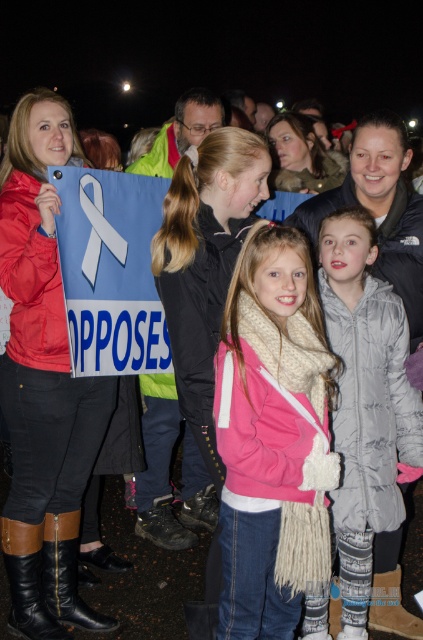
You are standing in the crowd at the event and want to find the pink fleece jacket at center. Based on the coordinates provided, in which direction should you look relative to the woman in the red jacket and black pants?

The pink fleece jacket at center is located at coordinates point (272, 436) relative to the woman in the red jacket and black pants. Since the coordinates are given as x and y values, the exact direction would require knowing the coordinate system, but generally, the pink fleece jacket at center is positioned to the right and slightly above the woman.

You are a photographer setting up a tripod to capture the scene. The tripod requires a minimum width of 15 cm between two objects to stabilize. Given the black leather boot at lower left and the brown suede boot at lower center, can the tripod be placed between them?

The black leather boot at lower left has a larger width than the brown suede boot at lower center. However, the exact width measurements are not provided, so it is uncertain if the space between them meets the tripod requirement. Further measurement is needed.

You are a photographer trying to capture the scene. You notice the black leather boot at lower left and the brown suede boot at lower center. Which boot should you focus on to ensure it appears larger in your photo?

The black leather boot at lower left is bigger than the brown suede boot at lower center, so focusing on it will make it appear larger in the photo.